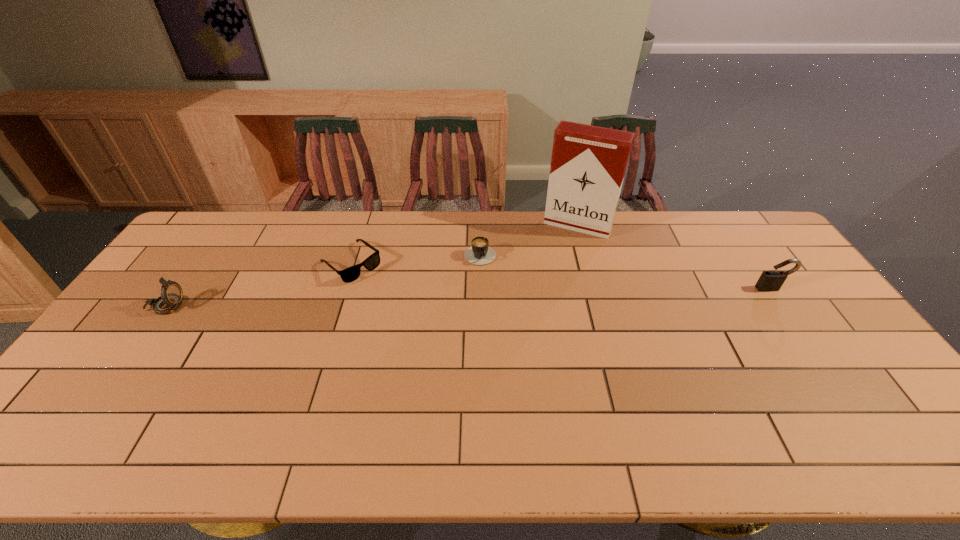
You are a GUI agent. You are given a task and a screenshot of the screen. Output one action in this format:
    pyautogui.click(x=<x>, y=<y>)
    Task: Click on the empty space that is in between the rightmost object and the sunglasses
    
    Given the screenshot: What is the action you would take?
    pyautogui.click(x=561, y=276)

Where is `free space between the sunglasses and the second object from right to left`? The image size is (960, 540). free space between the sunglasses and the second object from right to left is located at coordinates (465, 244).

Where is `free space that is in between the leftmost object and the third object from right to left`? free space that is in between the leftmost object and the third object from right to left is located at coordinates (323, 279).

Identify the location of free spot between the padlock and the nearest object. (468, 298).

Identify the location of vacant area that lies between the rightmost object and the nearest object. The image size is (960, 540). (468, 298).

Where is `free space between the nearest object and the fourth object from right to left`? This screenshot has height=540, width=960. free space between the nearest object and the fourth object from right to left is located at coordinates pyautogui.click(x=257, y=285).

Locate an element on the screen. The width and height of the screenshot is (960, 540). vacant area between the rightmost object and the cigarette_case is located at coordinates (675, 257).

Where is `unoccupied position between the sunglasses and the third object from left to right`? The image size is (960, 540). unoccupied position between the sunglasses and the third object from left to right is located at coordinates (416, 257).

I want to click on unoccupied area between the padlock and the cigarette_case, so click(x=675, y=257).

Choose which object is the third nearest neighbor to the compass. Please provide its 2D coordinates. Your answer should be formatted as a tuple, i.e. [(x, y)], where the tuple contains the x and y coordinates of a point satisfying the conditions above.

[(588, 163)]